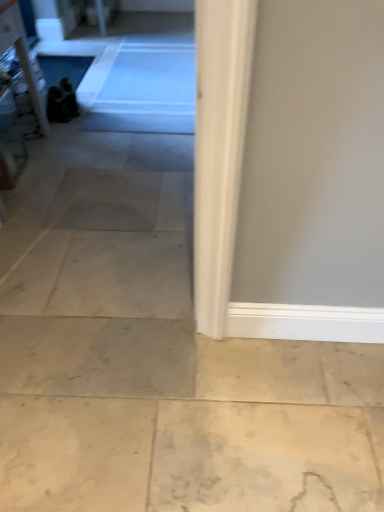
I want to click on brushed metal bookshelf at left, so click(21, 54).

Describe the element at coordinates (21, 54) in the screenshot. I see `brushed metal bookshelf at left` at that location.

I want to click on brushed metal bookshelf at left, so click(x=21, y=54).